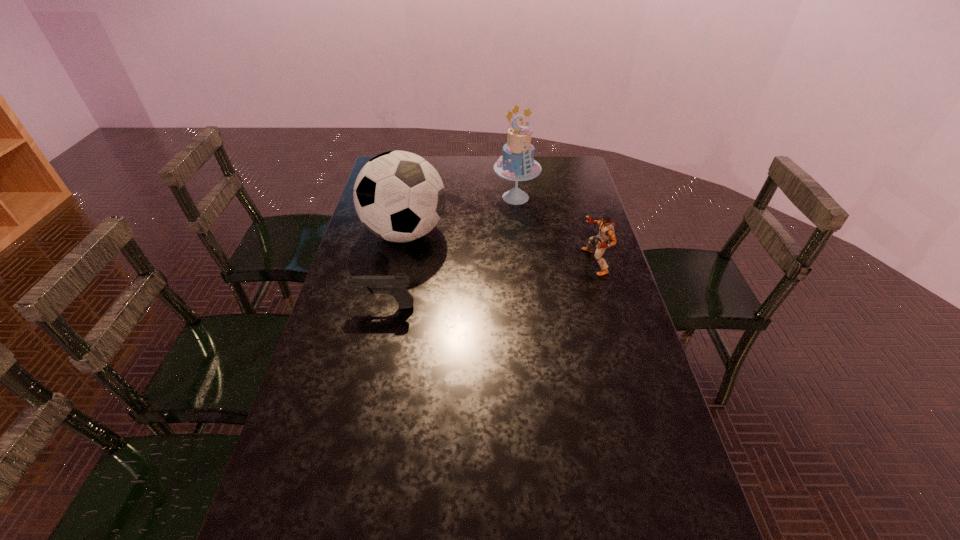
Find the location of a particular element. vacant space at the near edge is located at coordinates (520, 504).

The height and width of the screenshot is (540, 960). Identify the location of vacant area at the left edge. (362, 263).

Where is `free spot at the right edge of the desktop`? This screenshot has height=540, width=960. free spot at the right edge of the desktop is located at coordinates point(574,184).

At what (x,y) coordinates should I click in order to perform the action: click on vacant space that's between the nearest object and the third object from left to right. Please return your answer as a coordinate pair (x, y). Image resolution: width=960 pixels, height=540 pixels. Looking at the image, I should click on (450, 252).

Find the location of a particular element. vacant space that's between the nearest object and the rightmost object is located at coordinates (490, 284).

Find the location of a particular element. unoccupied position between the tallest object and the second shortest object is located at coordinates (555, 230).

Locate an element on the screen. vacant region between the cake and the shortest object is located at coordinates click(450, 252).

The image size is (960, 540). Find the location of `vacant space in between the pistol and the rightmost object`. vacant space in between the pistol and the rightmost object is located at coordinates (490, 284).

Identify the location of blank region between the nearest object and the rightmost object. The height and width of the screenshot is (540, 960). (490, 284).

You are a GUI agent. You are given a task and a screenshot of the screen. Output one action in this format:
    pyautogui.click(x=<x>, y=<y>)
    Task: Click on the free point between the third shortest object and the tallest object
    The width and height of the screenshot is (960, 540).
    Given the screenshot: What is the action you would take?
    pyautogui.click(x=461, y=215)